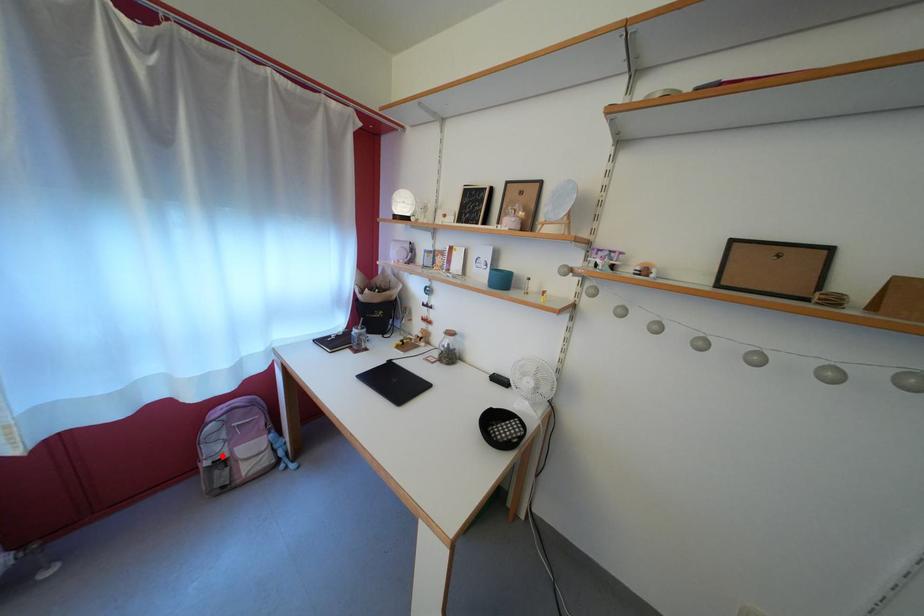
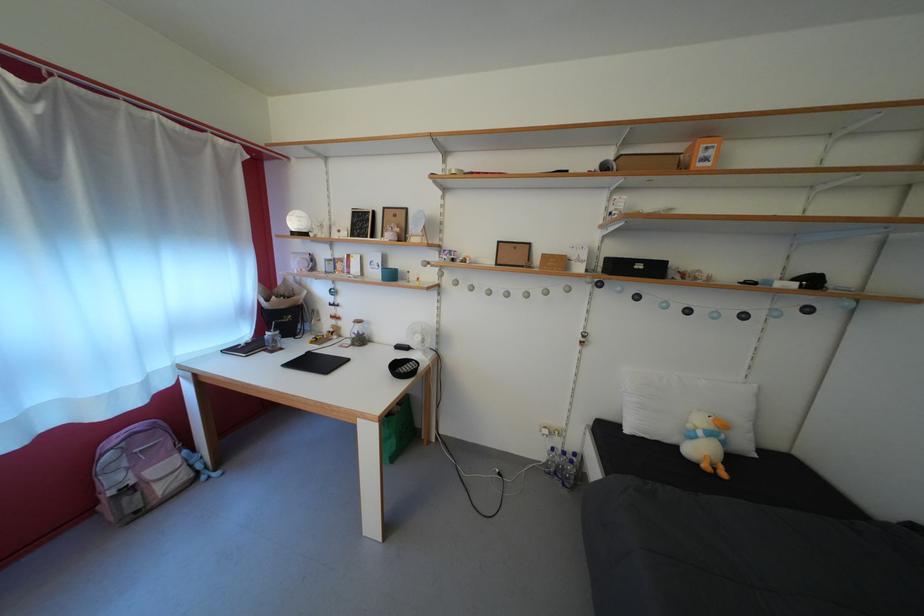
Question: I am providing you with two images of the same scene from different viewpoints. In image1, a red point is highlighted. Considering the same 3D point in image2, which of the following is correct?

Choices:
 (A) It is closer
 (B) It is farther

Answer: (B)